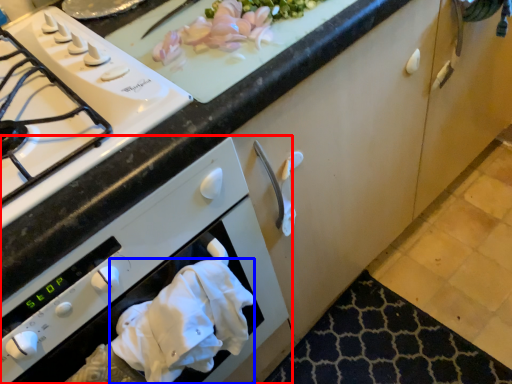
Question: Among these objects, which one is nearest to the camera, oven (highlighted by a red box) or hand towel (highlighted by a blue box)?

Choices:
 (A) oven
 (B) hand towel

Answer: (A)